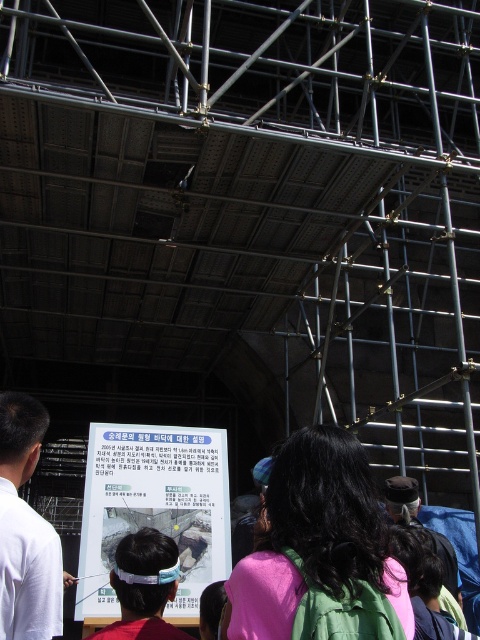
You are a construction worker standing at the base of the scaffolding. You notice a white matte shirt at lower left and a light blue fabric headband at center. Which object is closer to the ground?

The light blue fabric headband at center is closer to the ground because the white matte shirt at lower left is located above it.

In the scene shown: You are observing a construction site with a large scaffolding structure. You notice two items in the scene described as the white matte shirt at lower left and the light blue fabric headband at center. Which of these two items is narrower?

The white matte shirt at lower left is narrower than the light blue fabric headband at center.

You are a construction worker standing in front of the display board. You notice the white paper at center and the light blue fabric headband at center. Which object is taller?

The light blue fabric headband at center is taller than the white paper at center.